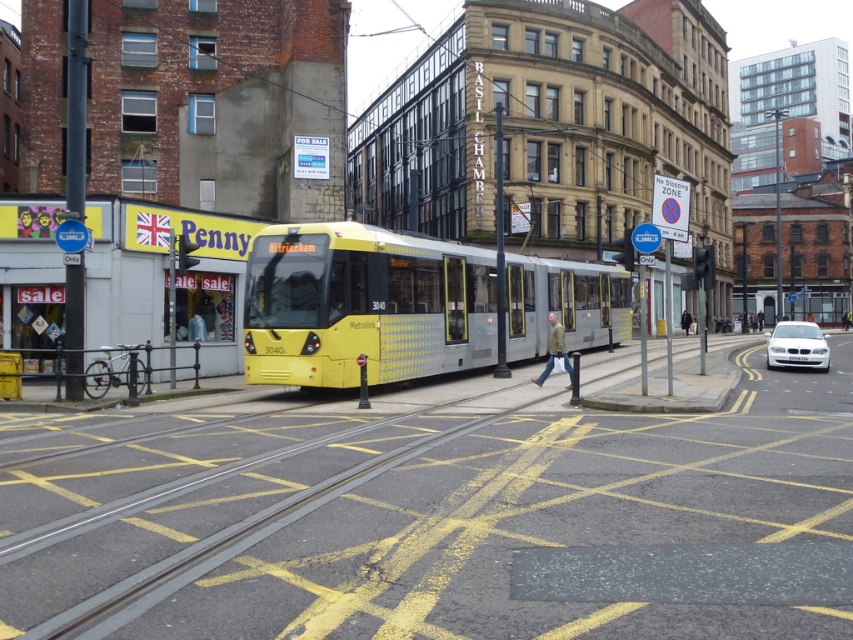
You are a city planner analyzing the tram route. The tram is at point (x=364, y=305). Where is the yellow metallic tram located in the scene?

The yellow metallic tram is located at the center of the scene, marked by the point (x=364, y=305).